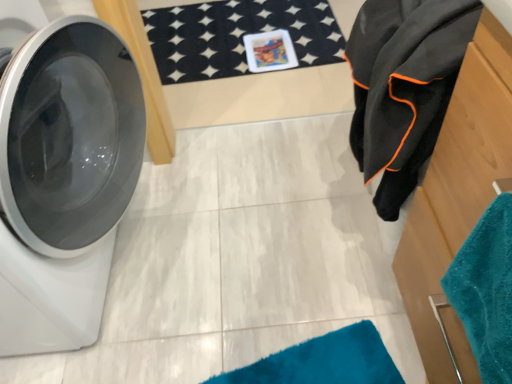
Question: Does point (471, 198) appear closer or farther from the camera than point (57, 321)?

Choices:
 (A) farther
 (B) closer

Answer: (B)

Question: Is wooden dresser at right inside or outside of white glossy washing machine at left?

Choices:
 (A) outside
 (B) inside

Answer: (A)

Question: Which is farther from the black fleece towel at right?

Choices:
 (A) white glossy washing machine at left
 (B) teal soft towel at right
 (C) wooden dresser at right

Answer: (A)

Question: Estimate the real-world distances between objects in this image. Which object is closer to the teal soft towel at right?

Choices:
 (A) white glossy washing machine at left
 (B) wooden dresser at right
 (C) black fleece towel at right

Answer: (B)